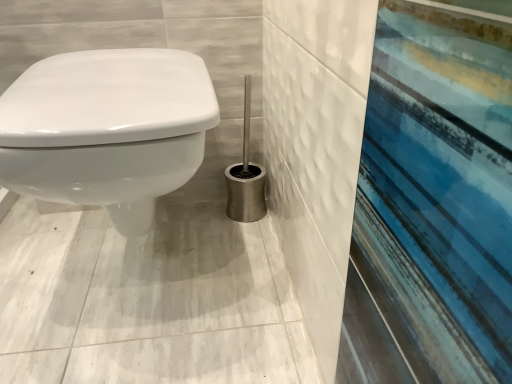
Locate an element on the screen. free space in front of satin silver toilet brush at center is located at coordinates (232, 244).